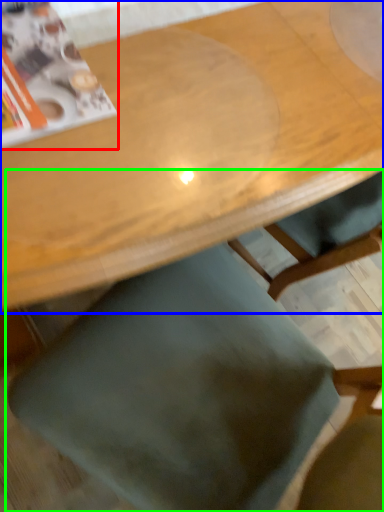
Question: Which object is the farthest from magazine (highlighted by a red box)? Choose among these: table (highlighted by a blue box) or chair (highlighted by a green box).

Choices:
 (A) table
 (B) chair

Answer: (B)